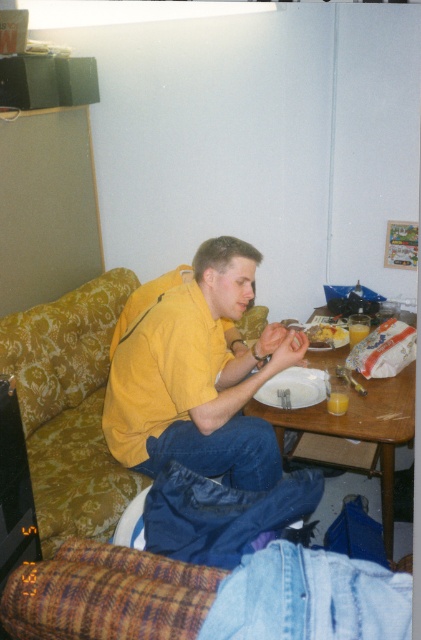
Does wooden table at center have a lesser width compared to yellowish matte plate at center?

Incorrect, wooden table at center's width is not less than yellowish matte plate at center's.

Can you confirm if wooden table at center is positioned above yellowish matte plate at center?

No, wooden table at center is not above yellowish matte plate at center.

Which is in front, point (311, 424) or point (324, 342)?

Point (311, 424)

This screenshot has height=640, width=421. In order to click on wooden table at center in this screenshot , I will do tap(360, 426).

Consider the image. Can you confirm if gold floral fabric couch at left is smaller than yellowish matte plate at center?

No.

Which is behind, point (23, 369) or point (319, 346)?

The point (23, 369) is behind.

In order to click on gold floral fabric couch at left in this screenshot , I will do `click(69, 406)`.

Which is more to the right, gold floral fabric couch at left or wooden table at center?

wooden table at center

Which is above, gold floral fabric couch at left or wooden table at center?

gold floral fabric couch at left is higher up.

Where is `gold floral fabric couch at left`? Image resolution: width=421 pixels, height=640 pixels. gold floral fabric couch at left is located at coordinates (69, 406).